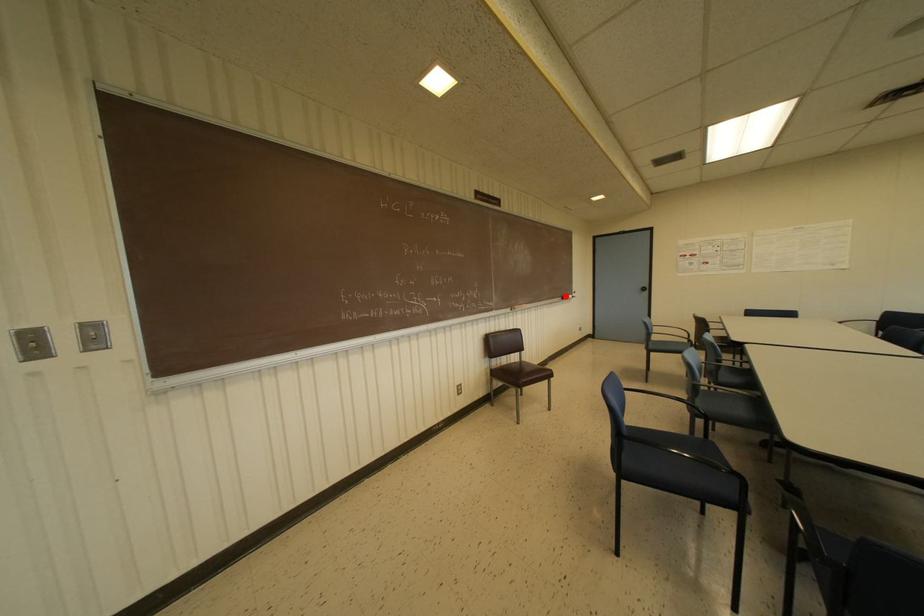
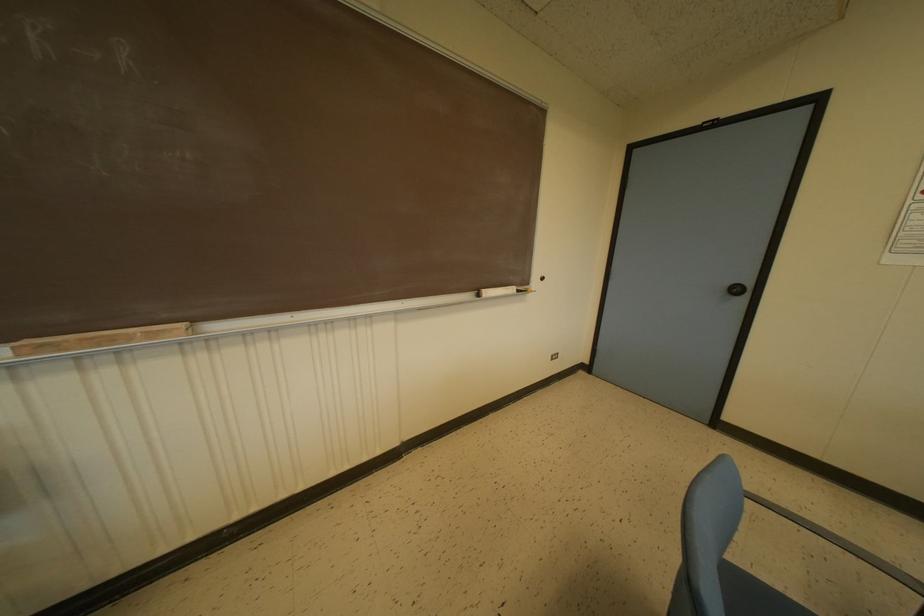
In the second image, find the point that corresponds to the highlighted location in the first image.

(487, 292)